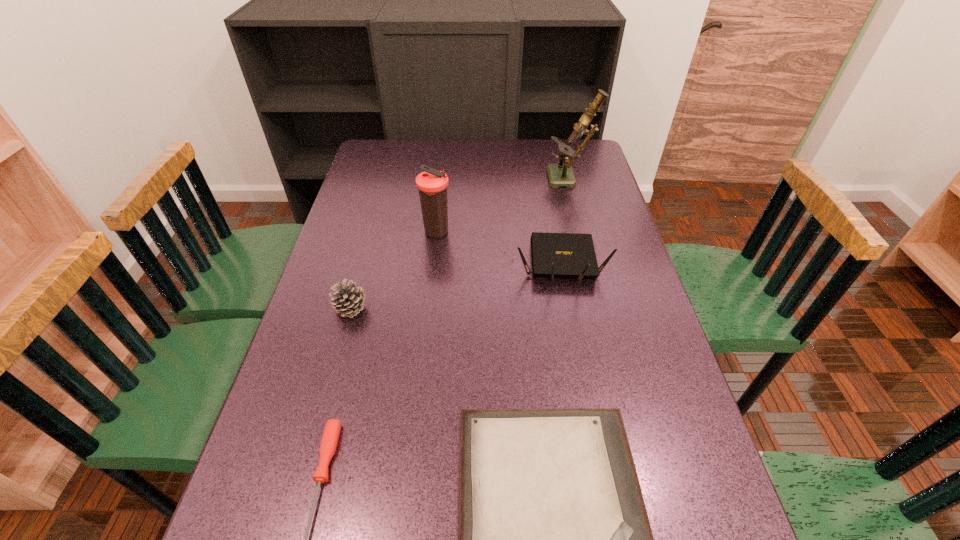
Identify the location of microscope. The width and height of the screenshot is (960, 540). (560, 174).

At what (x,y) coordinates should I click in order to perform the action: click on the farthest object. Please return your answer as a coordinate pair (x, y). The image size is (960, 540). Looking at the image, I should click on (560, 174).

Find the location of a particular element. The width and height of the screenshot is (960, 540). the third object from left to right is located at coordinates (x=432, y=184).

Where is `thermos bottle`? This screenshot has height=540, width=960. thermos bottle is located at coordinates (432, 184).

In order to click on the third tallest object in this screenshot , I will do `click(554, 255)`.

Where is `pinecone`? pinecone is located at coordinates (347, 299).

You are a GUI agent. You are given a task and a screenshot of the screen. Output one action in this format:
    pyautogui.click(x=<x>, y=<y>)
    Task: Click on the third shortest object
    This screenshot has height=540, width=960.
    Given the screenshot: What is the action you would take?
    pyautogui.click(x=347, y=299)

Identify the location of free region located 0.260m at the eyepiece of the farthest object. The width and height of the screenshot is (960, 540). (474, 179).

What are the coordinates of `free region located at the eyepiece of the farthest object` in the screenshot? It's located at (471, 179).

Where is `vacant area situated at the eyepiece of the farthest object`? The image size is (960, 540). vacant area situated at the eyepiece of the farthest object is located at coordinates (486, 179).